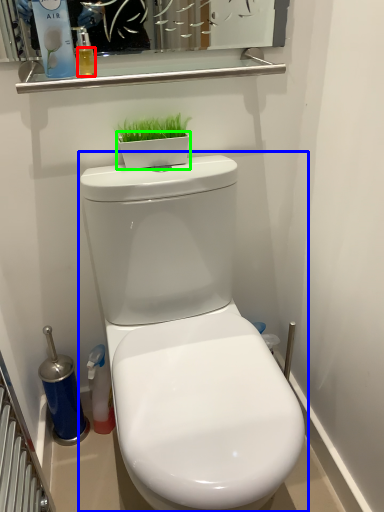
Question: Which object is positioned farthest from liquid (highlighted by a red box)? Select from toilet (highlighted by a blue box) and flowerpot (highlighted by a green box).

Choices:
 (A) toilet
 (B) flowerpot

Answer: (A)